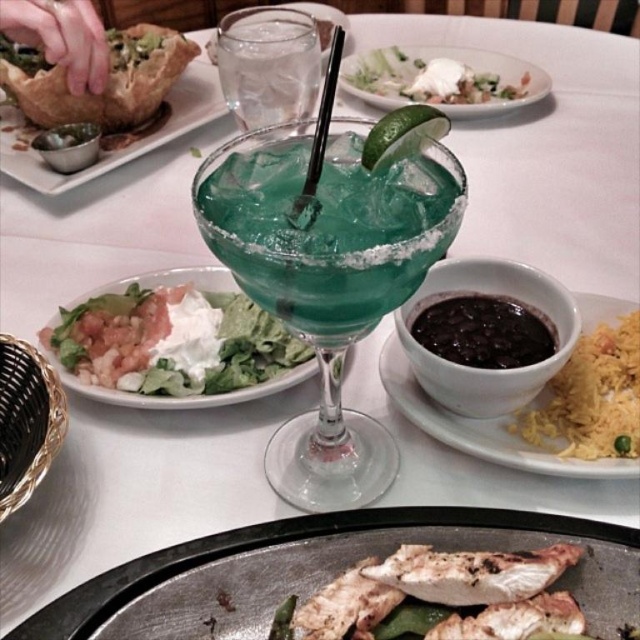
From the picture: You are a server who needs to place a 15 cm wide plate between the green leafy salad at left and the clear glass at center. Is there enough space?

The distance between the green leafy salad at left and the clear glass at center is 17.42 centimeters. Since the plate is 15 cm wide, there is enough space to place it between them.

You are looking at the dining table and see two points marked as point 1 at coordinates (122, 388) and point 2 at coordinates (317, 51). Which point is closer to you?

Point 1 at coordinates (122, 388) is closer to you than point 2 at coordinates (317, 51).

Based on the photo, you are a food photographer who needs to adjust the distance between the charcoal grill plate at center and the white creamy sauce at center to 15 inches for a better composition. Currently, they are 20.08 inches apart. How much closer should you move them?

The charcoal grill plate at center and the white creamy sauce at center are currently 20.08 inches apart. To achieve the desired 15 inches, you need to reduce the distance by 5.08 inches. Therefore, you should move them 5.08 inches closer together.